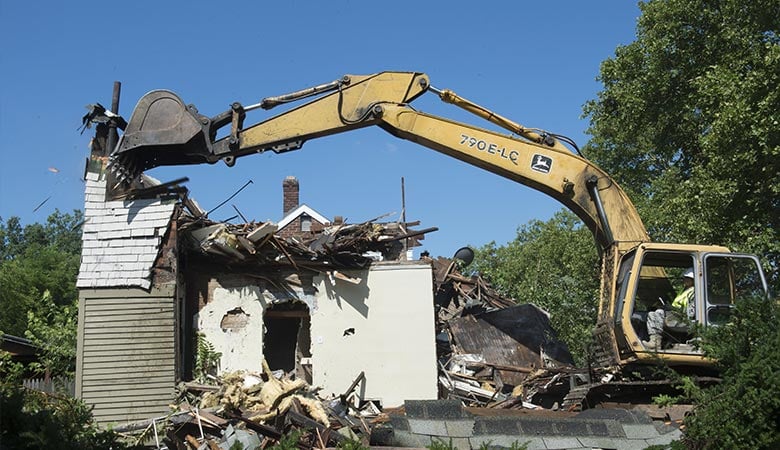
In order to click on white wall in this screenshot , I will do `click(399, 365)`.